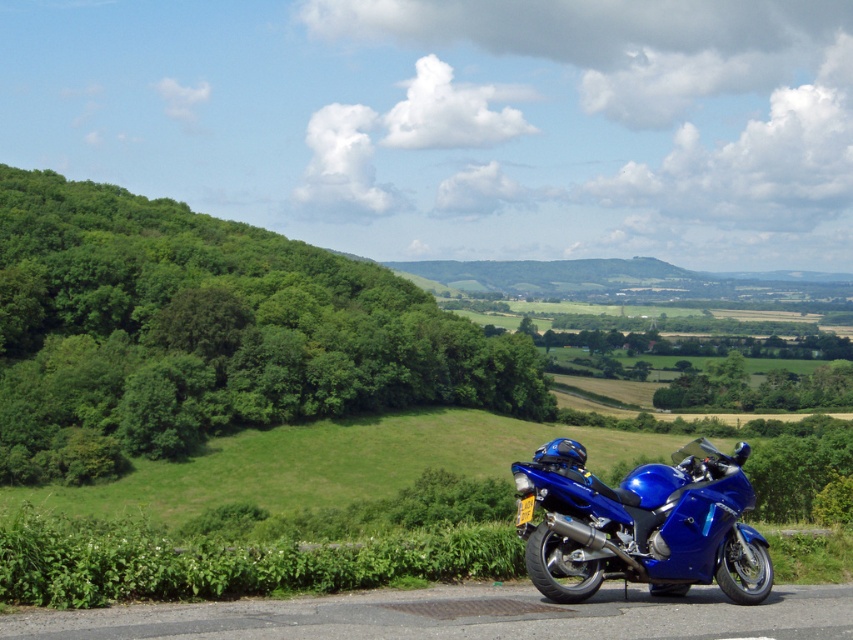
You are standing at the center of the road in the image and want to take a photo of the green leafy tree at left. Which direction should you face to ensure the tree is in the center of your camera view?

To center the green leafy tree at left in your camera view, you should face towards the left side of the road since the tree is located at the left side of the scene.

You are standing on the road near the blue motorcycle and want to walk to a point that is closer to the dense trees on the left. Which point should you go to, point (90, 204) or point (552, 508)?

You should go to point (90, 204) because it is closer to the dense trees on the left compared to point (552, 508).